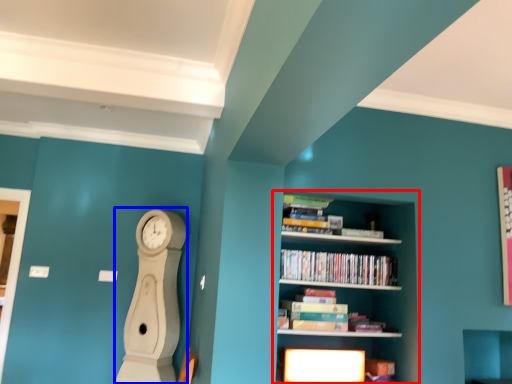
Question: Which point is closer to the camera, shelf (highlighted by a red box) or clock (highlighted by a blue box)?

Choices:
 (A) shelf
 (B) clock

Answer: (A)